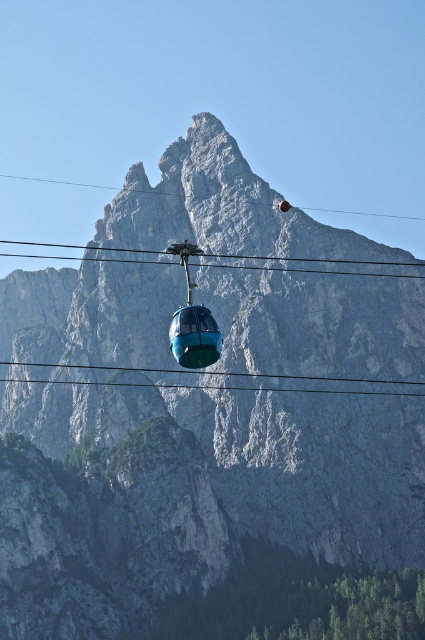
Where is `blue glossy cable car at center`? The height and width of the screenshot is (640, 425). blue glossy cable car at center is located at coordinates (192, 321).

Describe the element at coordinates (192, 321) in the screenshot. I see `blue glossy cable car at center` at that location.

You are a GUI agent. You are given a task and a screenshot of the screen. Output one action in this format:
    pyautogui.click(x=<x>, y=<y>)
    Task: Click on the blue glossy cable car at center
    The image size is (425, 640).
    Given the screenshot: What is the action you would take?
    pyautogui.click(x=192, y=321)

Which is behind, point (354, 262) or point (170, 385)?

Point (354, 262)

Can you confirm if black cable at center is shorter than blue cable car at center?

No.

Between point (184, 257) and point (167, 371), which one is positioned in front?

Positioned in front is point (184, 257).

In order to click on black cable at center in this screenshot , I will do `click(303, 266)`.

Which is more to the right, blue glassy gondola at center or transparent cable at upper center?

blue glassy gondola at center is more to the right.

Between blue glassy gondola at center and transparent cable at upper center, which one is positioned higher?

transparent cable at upper center is above.

This screenshot has height=640, width=425. Identify the location of blue glassy gondola at center. (195, 337).